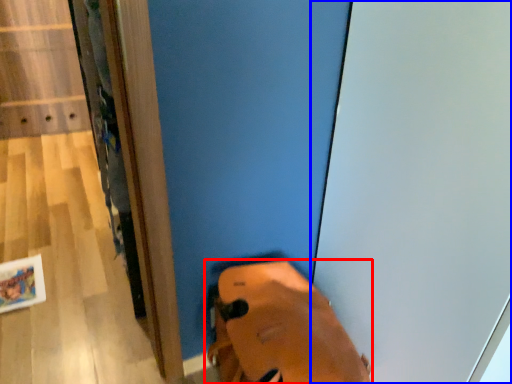
Question: Which object is closer to the camera taking this photo, footwear (highlighted by a red box) or screen door (highlighted by a blue box)?

Choices:
 (A) footwear
 (B) screen door

Answer: (B)